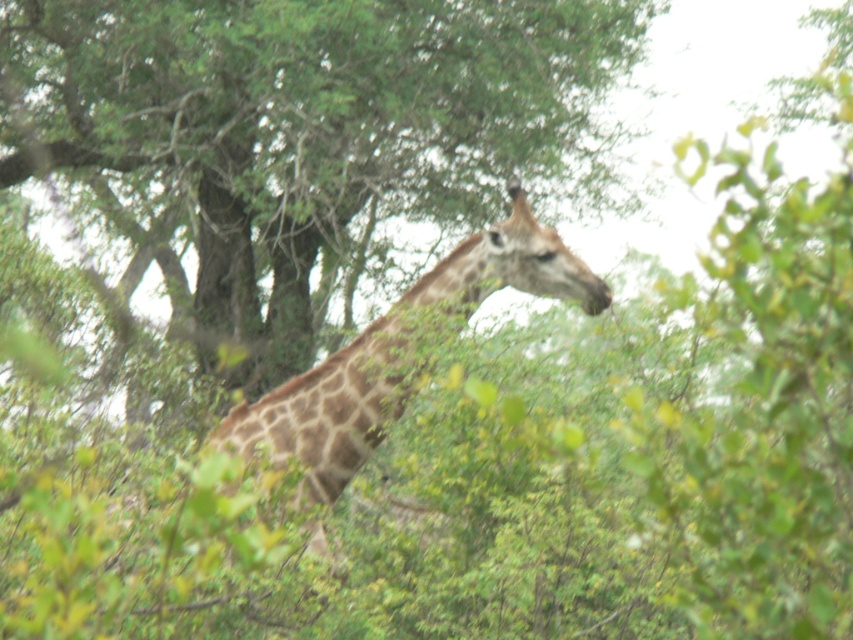
Question: Where is green leafy tree at center located in relation to brown spotted giraffe at center in the image?

Choices:
 (A) below
 (B) above

Answer: (B)

Question: Can you confirm if green leafy tree at center is smaller than brown spotted giraffe at center?

Choices:
 (A) yes
 (B) no

Answer: (B)

Question: Among these objects, which one is nearest to the camera?

Choices:
 (A) brown spotted giraffe at center
 (B) green leafy tree at center

Answer: (A)

Question: Which object is closer to the camera taking this photo?

Choices:
 (A) green leafy tree at center
 (B) brown spotted giraffe at center

Answer: (B)

Question: From the image, what is the correct spatial relationship of green leafy tree at center in relation to brown spotted giraffe at center?

Choices:
 (A) right
 (B) left

Answer: (B)

Question: Which of the following is the farthest from the observer?

Choices:
 (A) brown spotted giraffe at center
 (B) green leafy tree at center

Answer: (B)